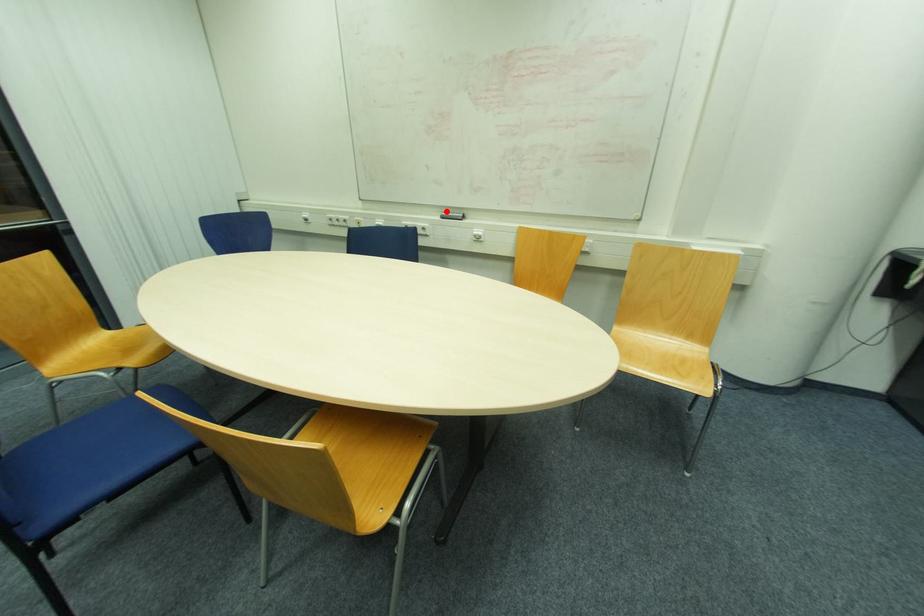
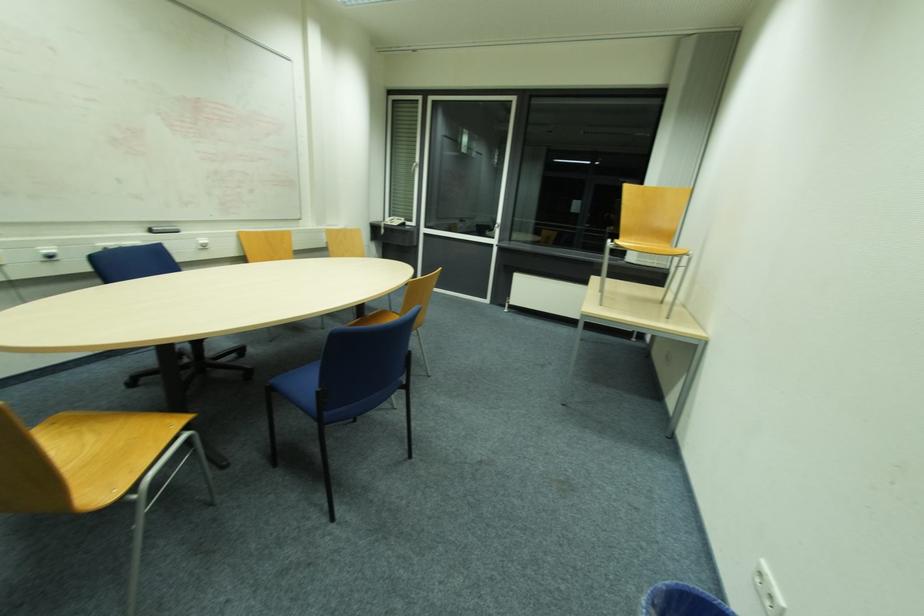
In the second image, find the point that corresponds to the highlighted location in the first image.

(151, 227)